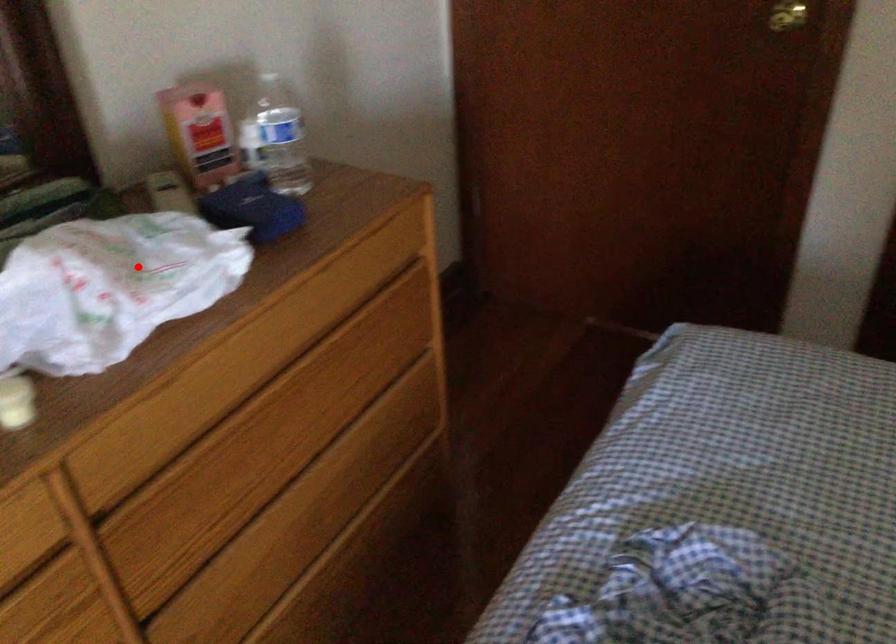
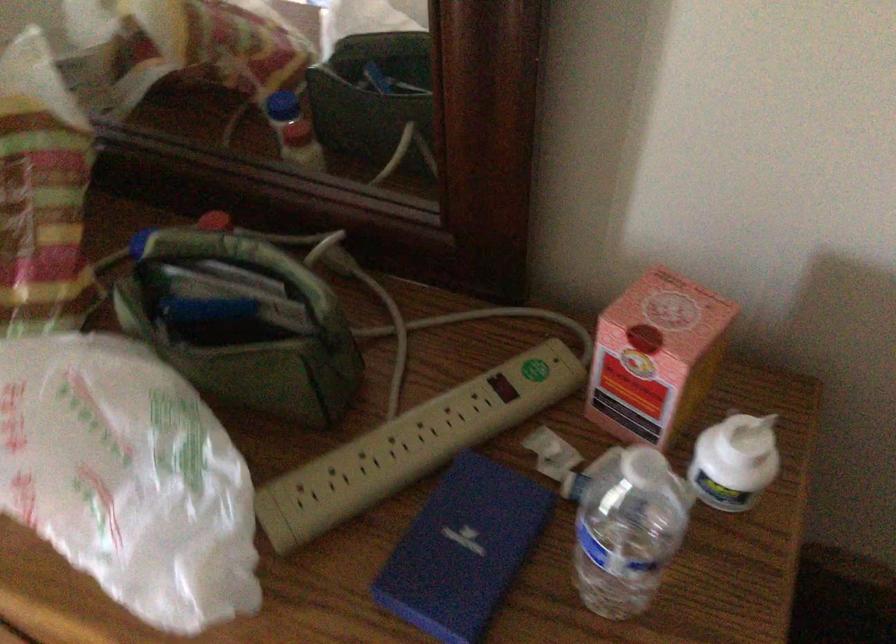
Question: I am providing you with two images of the same scene from different viewpoints. In image1, a red point is highlighted. Considering the same 3D point in image2, which of the following is correct?

Choices:
 (A) It is closer
 (B) It is farther

Answer: (A)